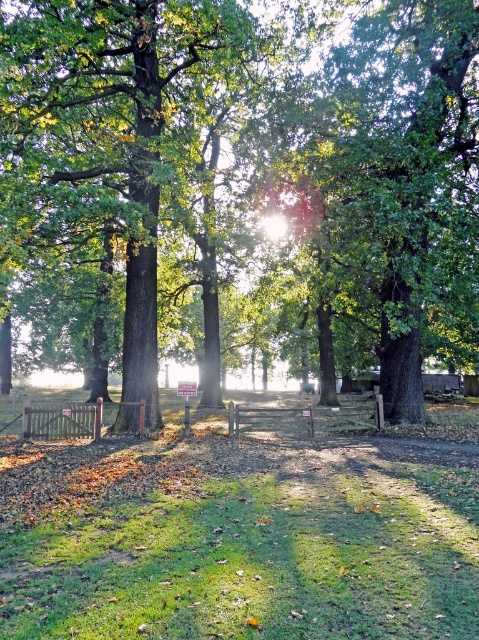
At what (x,y) coordinates should I click in order to perform the action: click on green leafy tree at center. Please return your answer as a coordinate pair (x, y). Looking at the image, I should click on (252, 173).

Is point (331, 13) farther from camera compared to point (344, 406)?

No, it is not.

At what (x,y) coordinates should I click in order to perform the action: click on green leafy tree at center. Please return your answer as a coordinate pair (x, y). The height and width of the screenshot is (640, 479). Looking at the image, I should click on (252, 173).